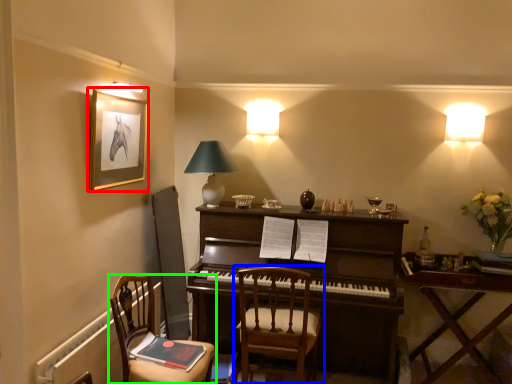
Question: Based on their relative distances, which object is nearer to picture frame (highlighted by a red box)? Choose from chair (highlighted by a blue box) and chair (highlighted by a green box).

Choices:
 (A) chair
 (B) chair

Answer: (B)